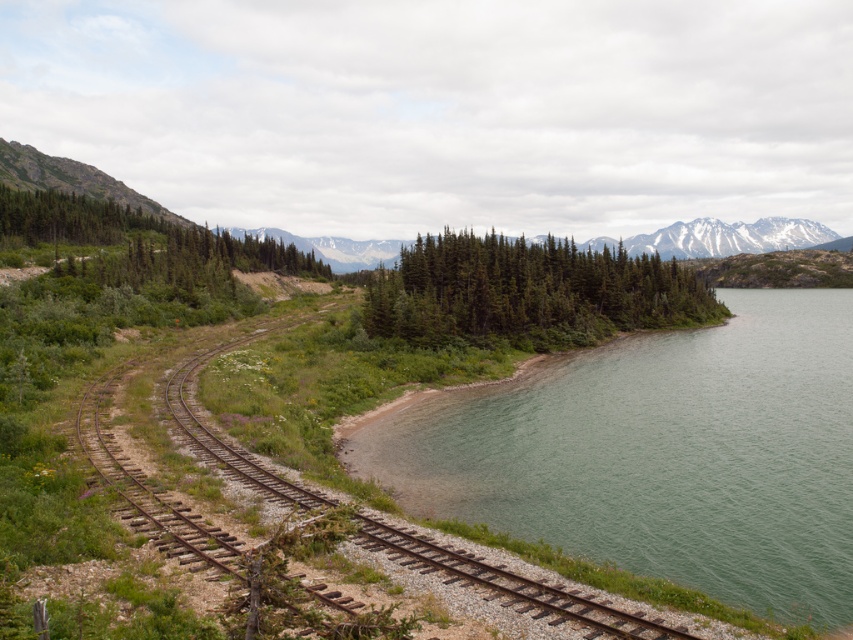
You are standing at the edge of the green smooth water at center right and want to reach the brown metal track at left. According to the scene, which direction should you move to reach the track?

The green smooth water at center right is located below the brown metal track at left, so you should move upwards to reach the brown metal track at left.

You are a photographer planning to capture a wide shot of the landscape. You want to include both the green smooth water at center right and the green textured trees at center in your frame. Based on their sizes, which object will occupy more space in the photo?

The green textured trees at center will occupy more space in the photo because the green smooth water at center right has a smaller size compared to them.

You are standing at the edge of the lake and want to cross to the other side. The brown metal track at left and the green smooth water at center right are in your path. Which object is closer to you, and can you walk over the closer one?

The brown metal track at left is behind green smooth water at center right, meaning the green smooth water at center right is closer to you. Since the green smooth water at center right is a body of water, you cannot walk over it. You would need to use the brown metal track at left, but it is further away.